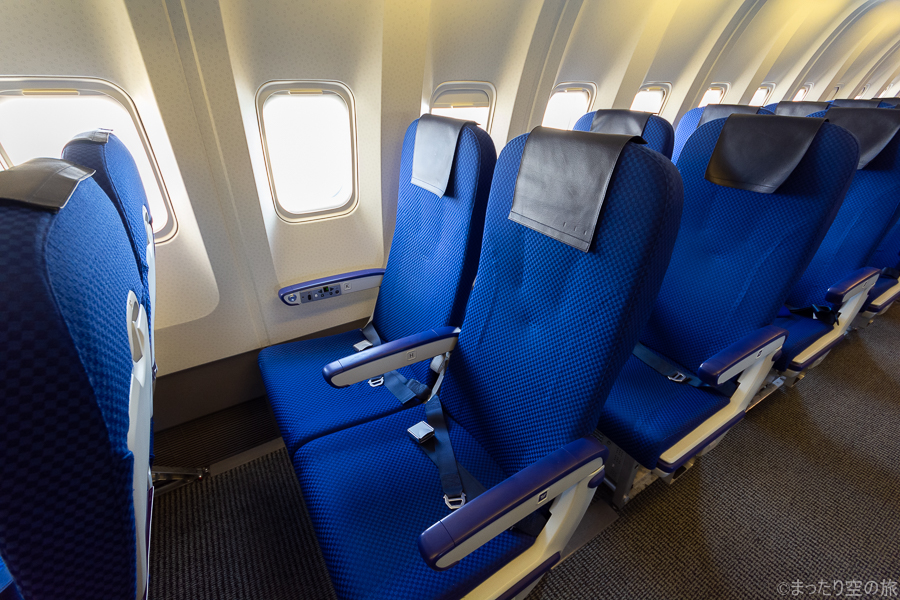
The width and height of the screenshot is (900, 600). Find the location of `armrest`. armrest is located at coordinates (531, 498), (408, 360), (347, 282), (743, 355), (855, 286).